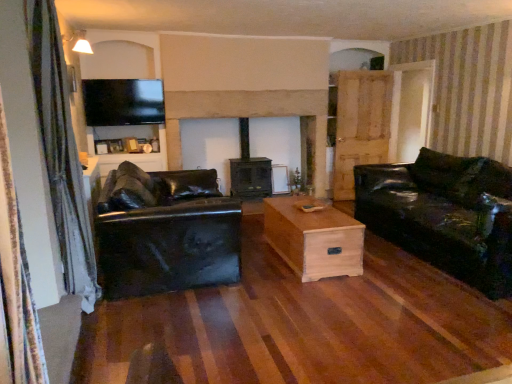
Question: Is black leather couch at left, marked as the 2th studio couch in a right-to-left arrangement, outside of light wood/texture coffee table at center?

Choices:
 (A) yes
 (B) no

Answer: (A)

Question: Could you tell me if black leather couch at left, acting as the first studio couch starting from the left, is facing light wood/texture coffee table at center?

Choices:
 (A) no
 (B) yes

Answer: (B)

Question: Are black leather couch at left, marked as the 2th studio couch in a right-to-left arrangement, and light wood/texture coffee table at center far apart?

Choices:
 (A) yes
 (B) no

Answer: (B)

Question: Can you confirm if black leather couch at left, marked as the 2th studio couch in a right-to-left arrangement, is bigger than light wood/texture coffee table at center?

Choices:
 (A) no
 (B) yes

Answer: (B)

Question: Is black leather couch at left, marked as the 2th studio couch in a right-to-left arrangement, at the left side of light wood/texture coffee table at center?

Choices:
 (A) yes
 (B) no

Answer: (A)

Question: Is matte black tv at upper left to the left or to the right of light wood/texture coffee table at center in the image?

Choices:
 (A) right
 (B) left

Answer: (B)

Question: Considering the positions of matte black tv at upper left and light wood/texture coffee table at center in the image, is matte black tv at upper left taller or shorter than light wood/texture coffee table at center?

Choices:
 (A) tall
 (B) short

Answer: (A)

Question: Is matte black tv at upper left spatially inside light wood/texture coffee table at center, or outside of it?

Choices:
 (A) inside
 (B) outside

Answer: (B)

Question: Is matte black tv at upper left wider or thinner than light wood/texture coffee table at center?

Choices:
 (A) thin
 (B) wide

Answer: (A)

Question: From the image's perspective, is smooth stone fireplace at center positioned above or below transparent glass door at right?

Choices:
 (A) below
 (B) above

Answer: (A)

Question: Which is correct: smooth stone fireplace at center is inside transparent glass door at right, or outside of it?

Choices:
 (A) inside
 (B) outside

Answer: (B)

Question: Looking at their shapes, would you say smooth stone fireplace at center is wider or thinner than transparent glass door at right?

Choices:
 (A) thin
 (B) wide

Answer: (B)

Question: From a real-world perspective, is smooth stone fireplace at center positioned above or below transparent glass door at right?

Choices:
 (A) below
 (B) above

Answer: (A)

Question: Which is correct: transparent glass door at right is inside matte black tv at upper left, or outside of it?

Choices:
 (A) outside
 (B) inside

Answer: (A)

Question: From the image's perspective, is transparent glass door at right located above or below matte black tv at upper left?

Choices:
 (A) below
 (B) above

Answer: (A)